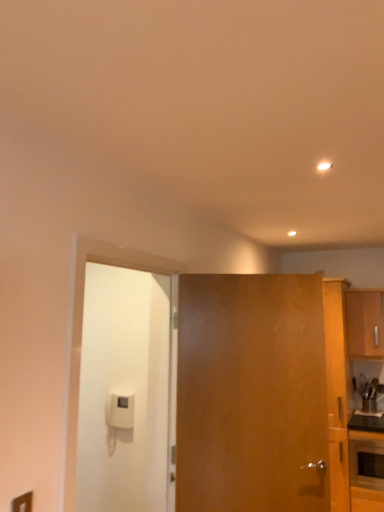
Question: Is wooden door at center, which is the first door in right-to-left order, smaller than matte black oven at lower right?

Choices:
 (A) no
 (B) yes

Answer: (A)

Question: Does wooden door at center, the 2th door from the left, have a lesser width compared to matte black oven at lower right?

Choices:
 (A) yes
 (B) no

Answer: (A)

Question: Does wooden door at center, which is the first door in right-to-left order, have a greater height compared to matte black oven at lower right?

Choices:
 (A) yes
 (B) no

Answer: (A)

Question: Is wooden door at center, which is the first door in right-to-left order, turned away from matte black oven at lower right?

Choices:
 (A) yes
 (B) no

Answer: (B)

Question: Does wooden door at center, which is the first door in right-to-left order, turn towards matte black oven at lower right?

Choices:
 (A) yes
 (B) no

Answer: (B)

Question: Considering the positions of point (375, 352) and point (132, 311), is point (375, 352) closer or farther from the camera than point (132, 311)?

Choices:
 (A) farther
 (B) closer

Answer: (A)

Question: Looking at the image, does wooden cabinet at right seem bigger or smaller compared to white matte door at left, the 1th door in the left-to-right sequence?

Choices:
 (A) big
 (B) small

Answer: (B)

Question: Considering the relative positions of wooden cabinet at right and white matte door at left, the 1th door in the left-to-right sequence, in the image provided, is wooden cabinet at right to the left or to the right of white matte door at left, the 1th door in the left-to-right sequence,?

Choices:
 (A) left
 (B) right

Answer: (B)

Question: Choose the correct answer: Is wooden cabinet at right inside white matte door at left, the 2th door when ordered from right to left, or outside it?

Choices:
 (A) inside
 (B) outside

Answer: (B)

Question: Is wooden door at center, the 2th door from the left, wider or thinner than wooden cabinet at right?

Choices:
 (A) wide
 (B) thin

Answer: (B)

Question: From the image's perspective, is wooden door at center, which is the first door in right-to-left order, positioned above or below wooden cabinet at right?

Choices:
 (A) below
 (B) above

Answer: (A)

Question: Considering the positions of wooden door at center, which is the first door in right-to-left order, and wooden cabinet at right in the image, is wooden door at center, which is the first door in right-to-left order, bigger or smaller than wooden cabinet at right?

Choices:
 (A) small
 (B) big

Answer: (B)

Question: In the image, is wooden door at center, the 2th door from the left, positioned in front of or behind wooden cabinet at right?

Choices:
 (A) front
 (B) behind

Answer: (A)

Question: Is matte black oven at lower right in front of or behind wooden cabinet at right in the image?

Choices:
 (A) front
 (B) behind

Answer: (A)

Question: Is point (352, 480) positioned closer to the camera than point (354, 354)?

Choices:
 (A) closer
 (B) farther

Answer: (A)